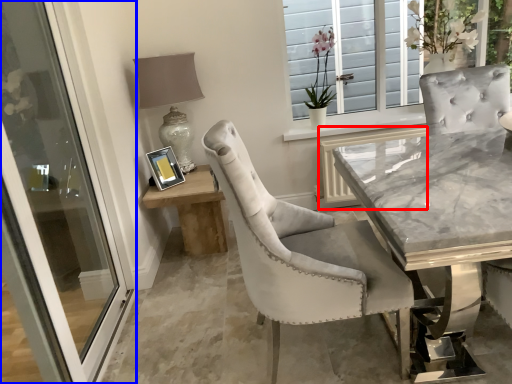
Question: Which of the following is the farthest to the observer, shutter (highlighted by a red box) or door (highlighted by a blue box)?

Choices:
 (A) shutter
 (B) door

Answer: (A)